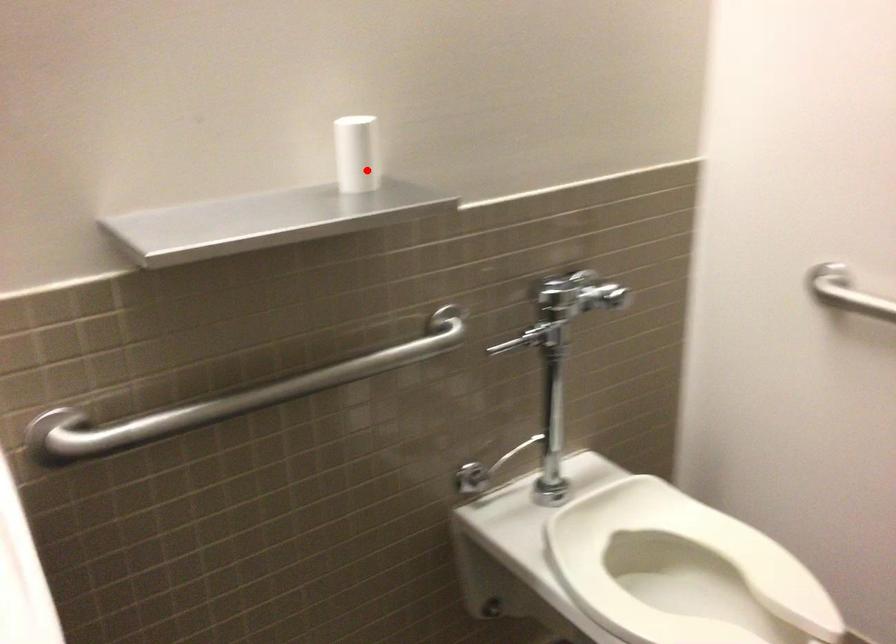
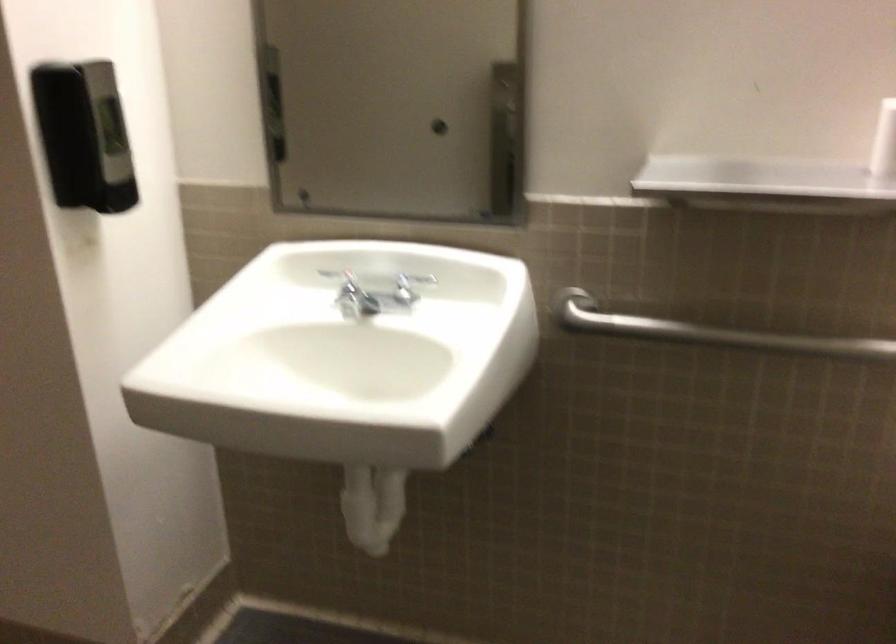
Locate, in the second image, the point that corresponds to the highlighted location in the first image.

(883, 142)